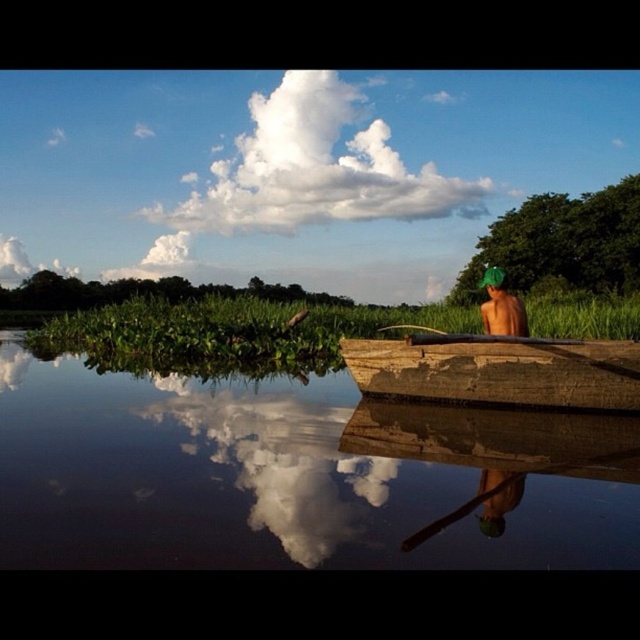
Question: Which object is positioned farthest from the white fluffy cloud at upper center?

Choices:
 (A) rusty wood boat at right
 (B) smooth brown water at center
 (C) green matte hat at upper right

Answer: (C)

Question: Can you confirm if white fluffy cloud at upper center is positioned to the right of green matte hat at upper right?

Choices:
 (A) yes
 (B) no

Answer: (B)

Question: Is rusty wood boat at right smaller than green matte hat at upper right?

Choices:
 (A) yes
 (B) no

Answer: (B)

Question: Can you confirm if smooth brown water at center is thinner than rusty wood boat at right?

Choices:
 (A) no
 (B) yes

Answer: (A)

Question: Among these points, which one is nearest to the camera?

Choices:
 (A) (576, 355)
 (B) (176, 257)
 (C) (481, 310)
 (D) (397, 518)

Answer: (D)

Question: Which of the following is the closest to the observer?

Choices:
 (A) smooth brown water at center
 (B) rusty wood boat at right
 (C) green matte hat at upper right

Answer: (A)